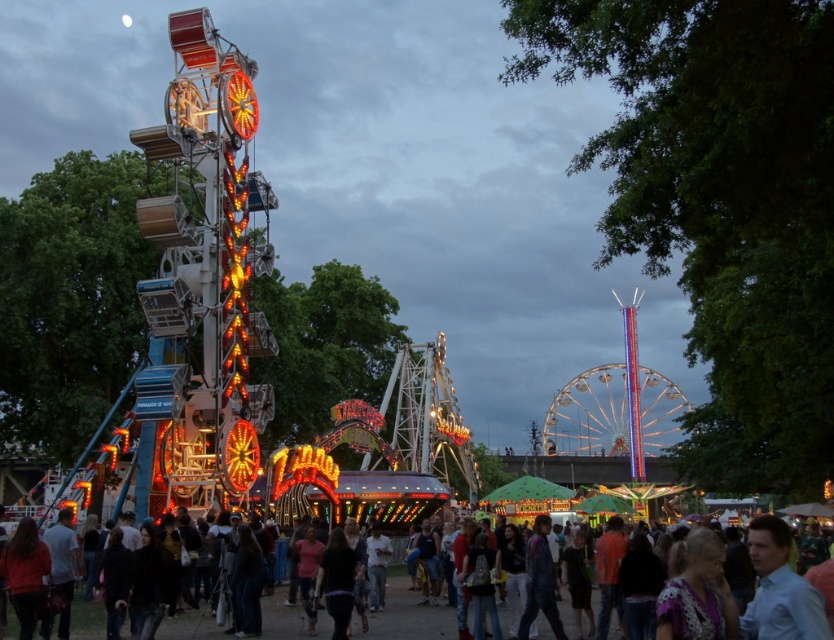
You are a photographer standing at the fairground. You want to take a photo of both the dark blue shirt at center and the light blue shirt at lower right. Which shirt should you focus on first if you want to capture both in the same frame without moving your camera?

The dark blue shirt at center is shorter than the light blue shirt at lower right. Therefore, you should focus on the dark blue shirt at center first, as it is closer to you, ensuring both are in focus when using a camera with a fixed focal point.

You are standing at the entrance of the fairground and see the illuminated metal ferris wheel at center and the light blue shirt at lower right. Which object is positioned more to the east?

The light blue shirt at lower right is positioned more to the east because the illuminated metal ferris wheel at center is to the right of it, implying the shirt is on the left side relative to the ferris wheel, which would be east if the ferris wheel is centered.